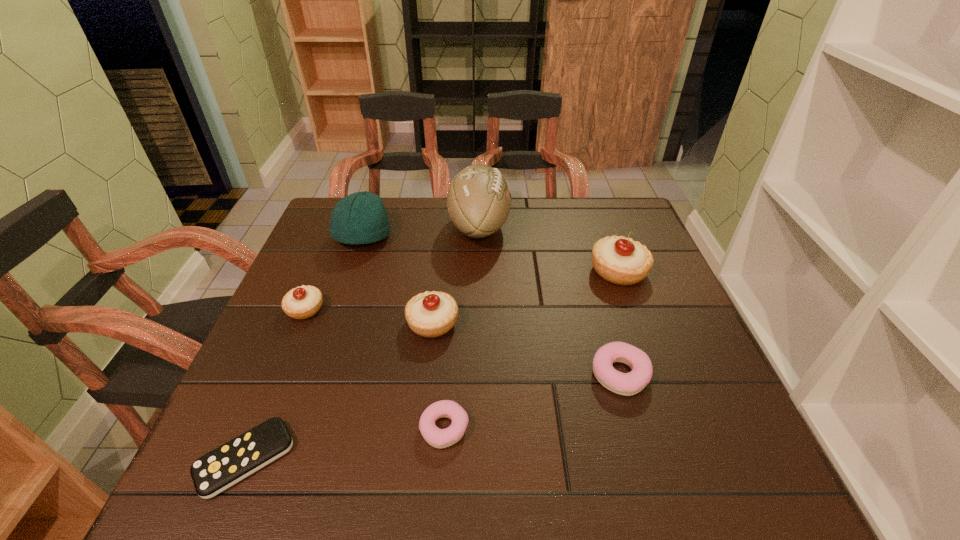
Locate an element on the screen. free space at the far edge is located at coordinates (430, 220).

Image resolution: width=960 pixels, height=540 pixels. Find the location of `free space at the near edge of the desktop`. free space at the near edge of the desktop is located at coordinates (413, 460).

The image size is (960, 540). I want to click on vacant space at the left edge of the desktop, so click(x=281, y=355).

In the image, there is a desktop. In order to click on vacant space at the right edge in this screenshot , I will do [636, 306].

The height and width of the screenshot is (540, 960). What are the coordinates of `vacant space at the far left corner` in the screenshot? It's located at (326, 225).

In the image, there is a desktop. In order to click on vacant space at the far right corner in this screenshot , I will do `click(636, 233)`.

This screenshot has width=960, height=540. In order to click on free area in between the shortest object and the tallest object in this screenshot , I will do `click(362, 343)`.

Where is `empty space that is in between the smaller pink pastry and the tallest object`? The width and height of the screenshot is (960, 540). empty space that is in between the smaller pink pastry and the tallest object is located at coordinates (462, 327).

The image size is (960, 540). Find the location of `unoccupied area between the beanie and the fifth tallest object`. unoccupied area between the beanie and the fifth tallest object is located at coordinates (334, 273).

Image resolution: width=960 pixels, height=540 pixels. Find the location of `empty space between the remote control and the smallest beige pastry`. empty space between the remote control and the smallest beige pastry is located at coordinates [x=276, y=384].